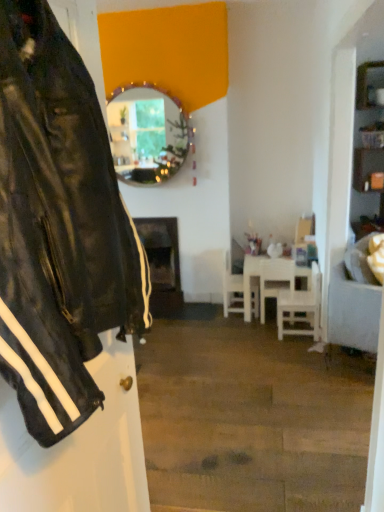
From the picture: In order to face white glossy chair at center, which is the 2th chair from left to right, should I rotate leftwards or rightwards?

A 11.033 degree turn to the right will do.

Identify the location of black leather jacket at left. The height and width of the screenshot is (512, 384). (58, 227).

The image size is (384, 512). Find the location of `wooden shelves at right`. wooden shelves at right is located at coordinates (368, 149).

Locate an element on the screen. white matte chair at center, the 3th chair positioned from the left is located at coordinates (300, 308).

Locate an element on the screen. The image size is (384, 512). white fabric couch at right is located at coordinates (353, 311).

This screenshot has width=384, height=512. What are the coordinates of `wooden-framed mirror at upper center` in the screenshot? It's located at (146, 135).

This screenshot has height=512, width=384. In order to click on white glossy chair at center, the second chair when ordered from right to left in this screenshot , I will do `click(275, 279)`.

Which is more to the left, white glossy chair at center, the second chair when ordered from right to left, or wooden-framed mirror at upper center?

wooden-framed mirror at upper center.

Are white glossy chair at center, which is the 2th chair from left to right, and wooden-framed mirror at upper center located far from each other?

white glossy chair at center, which is the 2th chair from left to right, is far away from wooden-framed mirror at upper center.

Where is `the 1st chair in front of the wooden-framed mirror at upper center`? the 1st chair in front of the wooden-framed mirror at upper center is located at coordinates (275, 279).

Looking at their sizes, would you say white glossy chair at center, the second chair when ordered from right to left, is wider or thinner than wooden-framed mirror at upper center?

white glossy chair at center, the second chair when ordered from right to left, is wider than wooden-framed mirror at upper center.

Is white fabric couch at right not close to white glossy chair at center, the second chair when ordered from right to left?

No, white fabric couch at right is in close proximity to white glossy chair at center, the second chair when ordered from right to left.

Is white fabric couch at right located outside white glossy chair at center, which is the 2th chair from left to right?

Yes, white fabric couch at right is located beyond the bounds of white glossy chair at center, which is the 2th chair from left to right.

Which of these two, white fabric couch at right or white glossy chair at center, which is the 2th chair from left to right, is wider?

white fabric couch at right is wider.

Is white fabric couch at right smaller than white glossy chair at center, the second chair when ordered from right to left?

No, white fabric couch at right is not smaller than white glossy chair at center, the second chair when ordered from right to left.

How different are the orientations of white matte chair at center, the 3th chair positioned from the left, and white matte chair at center, the first chair when ordered from left to right, in degrees?

The angular difference between white matte chair at center, the 3th chair positioned from the left, and white matte chair at center, the first chair when ordered from left to right, is 180 degrees.

Starting from the white matte chair at center, the first chair from the right, which chair is the 2nd one behind? Please provide its 2D coordinates.

[(232, 288)]

Would you consider white matte chair at center, the first chair from the right, to be distant from white matte chair at center, the third chair viewed from the right?

No, white matte chair at center, the first chair from the right, is not far away from white matte chair at center, the third chair viewed from the right.

From the image's perspective, which object appears higher, white matte chair at center, the first chair from the right, or white matte chair at center, the first chair when ordered from left to right?

From the image's view, white matte chair at center, the first chair when ordered from left to right, is above.

Is wooden shelves at right not close to white matte table at center?

wooden shelves at right is far away from white matte table at center.

From a real-world perspective, is wooden shelves at right positioned above or below white matte table at center?

Clearly, from a real-world perspective, wooden shelves at right is above white matte table at center.

Between wooden shelves at right and white matte table at center, which one is positioned in front?

Positioned in front is wooden shelves at right.

Looking at this image, considering the sizes of objects wooden shelves at right and white matte table at center in the image provided, who is taller, wooden shelves at right or white matte table at center?

wooden shelves at right is taller.

From a real-world perspective, is white matte table at center under white fabric couch at right?

Correct, in the physical world, white matte table at center is lower than white fabric couch at right.

Is white fabric couch at right located within white matte table at center?

No.

What's the angular difference between white matte table at center and white fabric couch at right's facing directions?

The angle between the facing direction of white matte table at center and the facing direction of white fabric couch at right is 151 degrees.

Is white matte table at center oriented away from white fabric couch at right?

No, white fabric couch at right is not at the back of white matte table at center.

From a real-world perspective, is black leather jacket at left above or below white matte chair at center, the 3th chair positioned from the left?

In terms of real-world spatial position, black leather jacket at left is above white matte chair at center, the 3th chair positioned from the left.

Is white matte chair at center, the 3th chair positioned from the left, surrounded by black leather jacket at left?

No, white matte chair at center, the 3th chair positioned from the left, is not surrounded by black leather jacket at left.

Which is behind, point (108, 186) or point (292, 318)?

The point (292, 318) is farther.

Could you tell me if wooden-framed mirror at upper center is facing white matte chair at center, the third chair viewed from the right?

No, wooden-framed mirror at upper center is not facing towards white matte chair at center, the third chair viewed from the right.

Can we say wooden-framed mirror at upper center lies outside white matte chair at center, the first chair when ordered from left to right?

Absolutely, wooden-framed mirror at upper center is external to white matte chair at center, the first chair when ordered from left to right.

Are wooden-framed mirror at upper center and white matte chair at center, the first chair when ordered from left to right, located far from each other?

Yes, wooden-framed mirror at upper center and white matte chair at center, the first chair when ordered from left to right, are located far from each other.

Where is `mirror above the white glossy chair at center, which is the 2th chair from left to right (from the image's perspective)`? The height and width of the screenshot is (512, 384). mirror above the white glossy chair at center, which is the 2th chair from left to right (from the image's perspective) is located at coordinates (146, 135).

From a real-world perspective, starting from the white fabric couch at right, which chair is the 2nd one below it? Please provide its 2D coordinates.

[(275, 279)]

From the image, which object appears to be farther from black leather jacket at left, white fabric couch at right or white matte chair at center, the first chair when ordered from left to right?

white matte chair at center, the first chair when ordered from left to right, is positioned further to the anchor black leather jacket at left.

Based on their spatial positions, is white matte chair at center, the third chair viewed from the right, or black matte fireplace at center closer to black leather jacket at left?

white matte chair at center, the third chair viewed from the right.

Estimate the real-world distances between objects in this image. Which object is closer to black matte fireplace at center, white fabric couch at right or wooden-framed mirror at upper center?

Based on the image, wooden-framed mirror at upper center appears to be nearer to black matte fireplace at center.

Considering their positions, is wooden-framed mirror at upper center positioned further to wooden shelves at right than white matte chair at center, the third chair viewed from the right?

Based on the image, wooden-framed mirror at upper center appears to be further to wooden shelves at right.

Based on their spatial positions, is white matte chair at center, the 3th chair positioned from the left, or wooden shelves at right closer to black leather jacket at left?

white matte chair at center, the 3th chair positioned from the left, is positioned closer to the anchor black leather jacket at left.

When comparing their distances from white matte chair at center, the first chair from the right, does white matte table at center or white glossy chair at center, which is the 2th chair from left to right, seem closer?

Based on the image, white glossy chair at center, which is the 2th chair from left to right, appears to be nearer to white matte chair at center, the first chair from the right.

Estimate the real-world distances between objects in this image. Which object is further from wooden shelves at right, black leather jacket at left or white matte chair at center, the 3th chair positioned from the left?

black leather jacket at left is further to wooden shelves at right.

Looking at the image, which one is located further to white matte chair at center, the 3th chair positioned from the left, wooden-framed mirror at upper center or white matte chair at center, the first chair when ordered from left to right?

wooden-framed mirror at upper center is further to white matte chair at center, the 3th chair positioned from the left.

You are a GUI agent. You are given a task and a screenshot of the screen. Output one action in this format:
    pyautogui.click(x=<x>, y=<y>)
    Task: Click on the cabinetry between black leather jacket at left and white glossy chair at center, which is the 2th chair from left to right, from front to back
    
    Given the screenshot: What is the action you would take?
    pyautogui.click(x=368, y=149)

In order to click on fireplace between wooden-framed mirror at upper center and wooden shelves at right from left to right in this screenshot , I will do `click(162, 263)`.

The width and height of the screenshot is (384, 512). What are the coordinates of `chair between wooden shelves at right and white glossy chair at center, the second chair when ordered from right to left, from top to bottom` in the screenshot? It's located at pyautogui.click(x=232, y=288).

Where is `studio couch situated between wooden-framed mirror at upper center and wooden shelves at right from left to right`? The image size is (384, 512). studio couch situated between wooden-framed mirror at upper center and wooden shelves at right from left to right is located at coordinates (353, 311).